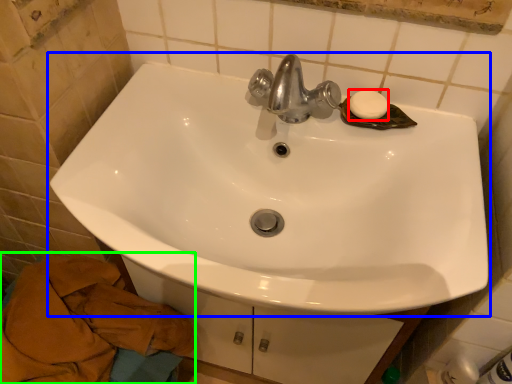
Question: Which is nearer to the soap (highlighted by a red box)? sink (highlighted by a blue box) or bath towel (highlighted by a green box).

Choices:
 (A) sink
 (B) bath towel

Answer: (A)